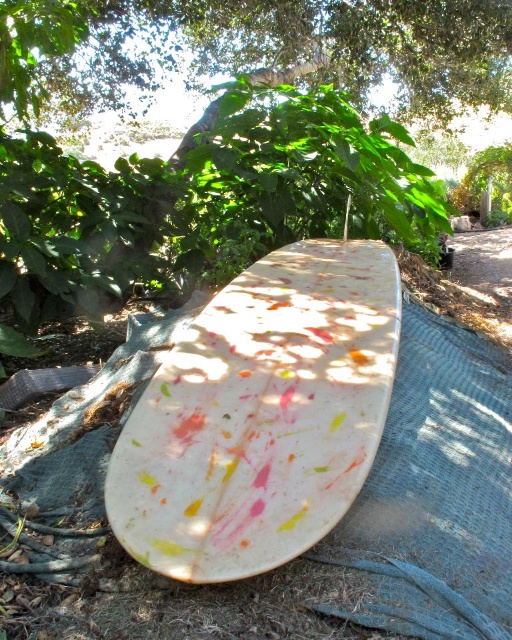
Question: Is painted wood surfboard at center closer to the viewer compared to green leafy tree at center?

Choices:
 (A) no
 (B) yes

Answer: (B)

Question: From the image, what is the correct spatial relationship of painted wood surfboard at center in relation to green leafy tree at center?

Choices:
 (A) above
 (B) below

Answer: (B)

Question: Can you confirm if painted wood surfboard at center is wider than green leafy tree at center?

Choices:
 (A) yes
 (B) no

Answer: (B)